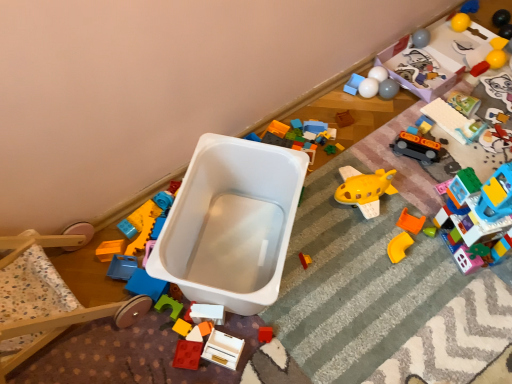
The image size is (512, 384). In order to click on free area in between white plastic baby carriage at center and orange plastic block at lower right, placed as the 10th toy when sorted from left to right in this screenshot , I will do `click(332, 256)`.